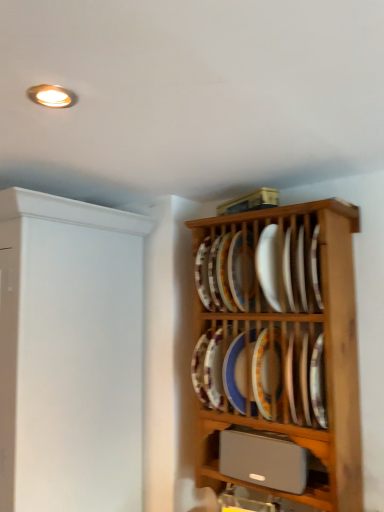
Question: Considering the positions of point (253, 250) and point (231, 398), is point (253, 250) closer or farther from the camera than point (231, 398)?

Choices:
 (A) farther
 (B) closer

Answer: (B)

Question: Would you say porcelain plate at center, which ranks as the 2th platter in top-to-bottom order, is to the left or to the right of blue glossy platter at center, the fifth platter in the top-to-bottom sequence, in the picture?

Choices:
 (A) right
 (B) left

Answer: (B)

Question: Estimate the real-world distances between objects in this image. Which object is farther from the porcelain plate at center, acting as the third platter starting from the bottom?

Choices:
 (A) wooden plate rack at upper right
 (B) silver metallic speaker at lower center
 (C) white matte cabinet at left
 (D) white glossy plate at center, which ranks as the fifth platter in bottom-to-top order
 (E) blue glossy platter at center, the first platter in the bottom-to-top sequence

Answer: (C)

Question: Based on their relative distances, which object is nearer to the porcelain plate at center, which ranks as the 2th platter in top-to-bottom order?

Choices:
 (A) porcelain plate at center, acting as the third platter starting from the bottom
 (B) white matte cabinet at left
 (C) white glossy plate at center, which ranks as the fifth platter in bottom-to-top order
 (D) porcelain plate at center, the 2th platter positioned from the bottom
 (E) blue glossy platter at center, the first platter in the bottom-to-top sequence

Answer: (C)